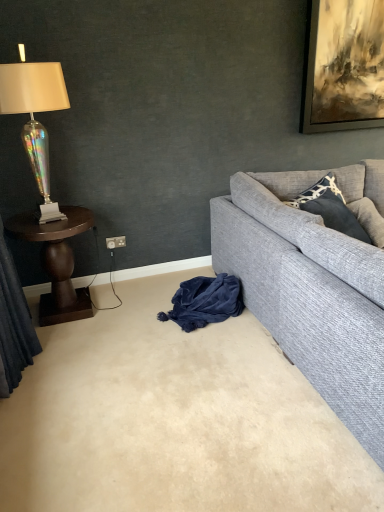
At what (x,y) coordinates should I click in order to perform the action: click on dark wood side table at left. Please return your answer as a coordinate pair (x, y). This screenshot has height=512, width=384. Looking at the image, I should click on (57, 262).

I want to click on iridescent fabric curtain at left, so click(x=14, y=325).

This screenshot has width=384, height=512. I want to click on white plastic power outlet at lower center, so click(115, 242).

Describe the element at coordinates (33, 117) in the screenshot. I see `iridescent glass lamp at left` at that location.

The width and height of the screenshot is (384, 512). Identify the location of velvet blue blanket at lower center. (205, 301).

Is dark gray textured pillow at upper right positioned before iridescent glass lamp at left?

No, dark gray textured pillow at upper right is further to the viewer.

Is dark gray textured pillow at upper right to the left of iridescent glass lamp at left from the viewer's perspective?

No, dark gray textured pillow at upper right is not to the left of iridescent glass lamp at left.

From the image's perspective, is dark gray textured pillow at upper right under iridescent glass lamp at left?

Indeed, from the image's perspective, dark gray textured pillow at upper right is shown beneath iridescent glass lamp at left.

Considering the sizes of objects dark gray textured pillow at upper right and iridescent glass lamp at left in the image provided, who is shorter, dark gray textured pillow at upper right or iridescent glass lamp at left?

dark gray textured pillow at upper right.

From the picture: Can you confirm if velvet blue blanket at lower center is taller than iridescent glass lamp at left?

No.

From a real-world perspective, which object rests below the other?

velvet blue blanket at lower center, from a real-world perspective.

Is point (186, 312) closer or farther from the camera than point (36, 89)?

Clearly, point (186, 312) is more distant from the camera than point (36, 89).

From the image's perspective, is velvet blue blanket at lower center located above or below iridescent glass lamp at left?

Based on their image positions, velvet blue blanket at lower center is located beneath iridescent glass lamp at left.

Is iridescent glass lamp at left next to dark wood side table at left?

No, iridescent glass lamp at left is not in contact with dark wood side table at left.

From the image's perspective, which object appears higher, iridescent glass lamp at left or dark wood side table at left?

iridescent glass lamp at left is shown above in the image.

Based on the photo, from a real-world perspective, does iridescent glass lamp at left stand above dark wood side table at left?

Correct, in the physical world, iridescent glass lamp at left is higher than dark wood side table at left.

Is iridescent glass lamp at left situated inside dark wood side table at left or outside?

The correct answer is: outside.

From the image's perspective, which one is positioned lower, iridescent glass lamp at left or dark gray textured pillow at upper right?

dark gray textured pillow at upper right appears lower in the image.

Considering the sizes of iridescent glass lamp at left and dark gray textured pillow at upper right in the image, is iridescent glass lamp at left wider or thinner than dark gray textured pillow at upper right?

iridescent glass lamp at left is wider than dark gray textured pillow at upper right.

Does point (59, 83) appear closer or farther from the camera than point (326, 215)?

Point (59, 83) is closer to the camera than point (326, 215).

Which is behind, gray fabric couch at right or velvet blue blanket at lower center?

velvet blue blanket at lower center.

From a real-world perspective, is gray fabric couch at right on velvet blue blanket at lower center?

Yes.

Between gray fabric couch at right and velvet blue blanket at lower center, which one has larger width?

gray fabric couch at right.

From the image's perspective, would you say gray fabric couch at right is shown under beige carpet at lower center?

No, from the image's perspective, gray fabric couch at right is not beneath beige carpet at lower center.

From a real-world perspective, is gray fabric couch at right physically above beige carpet at lower center?

Yes, from a real-world perspective, gray fabric couch at right is on top of beige carpet at lower center.

Does gray fabric couch at right lie in front of beige carpet at lower center?

That is True.

Is gray fabric couch at right next to beige carpet at lower center and touching it?

They are not placed beside each other.

How different are the orientations of beige carpet at lower center and white plastic power outlet at lower center in degrees?

The angular difference between beige carpet at lower center and white plastic power outlet at lower center is 178 degrees.

Is beige carpet at lower center oriented towards white plastic power outlet at lower center?

No, beige carpet at lower center is not facing towards white plastic power outlet at lower center.

From their relative heights in the image, would you say beige carpet at lower center is taller or shorter than white plastic power outlet at lower center?

In the image, beige carpet at lower center appears to be shorter than white plastic power outlet at lower center.

Can you confirm if beige carpet at lower center is bigger than white plastic power outlet at lower center?

Yes, beige carpet at lower center is bigger than white plastic power outlet at lower center.

At what (x,y) coordinates should I click in order to perform the action: click on lamp in front of the dark gray textured pillow at upper right. Please return your answer as a coordinate pair (x, y). This screenshot has height=512, width=384. Looking at the image, I should click on 33,117.

Where is `material behind the iridescent glass lamp at left`? Image resolution: width=384 pixels, height=512 pixels. material behind the iridescent glass lamp at left is located at coordinates (205, 301).

Looking at the image, which one is located closer to dark gray textured pillow at upper right, iridescent glass lamp at left or gray fabric couch at right?

gray fabric couch at right lies closer to dark gray textured pillow at upper right than the other object.

Considering their positions, is dark gray textured pillow at upper right positioned further to gray fabric couch at right than dark wood side table at left?

dark wood side table at left lies further to gray fabric couch at right than the other object.

Estimate the real-world distances between objects in this image. Which object is closer to iridescent glass lamp at left, iridescent fabric curtain at left or dark gray textured pillow at upper right?

iridescent fabric curtain at left is positioned closer to the anchor iridescent glass lamp at left.

From the image, which object appears to be farther from beige carpet at lower center, gray fabric couch at right or velvet blue blanket at lower center?

Among the two, gray fabric couch at right is located further to beige carpet at lower center.

Which object lies further to the anchor point dark wood side table at left, beige carpet at lower center or gray fabric couch at right?

gray fabric couch at right is positioned further to the anchor dark wood side table at left.

Looking at the image, which one is located closer to velvet blue blanket at lower center, iridescent glass lamp at left or gray fabric couch at right?

gray fabric couch at right is positioned closer to the anchor velvet blue blanket at lower center.

Looking at the image, which one is located further to white plastic power outlet at lower center, dark wood side table at left or velvet blue blanket at lower center?

The object further to white plastic power outlet at lower center is velvet blue blanket at lower center.

From the image, which object appears to be nearer to beige carpet at lower center, iridescent glass lamp at left or gray fabric couch at right?

Among the two, gray fabric couch at right is located nearer to beige carpet at lower center.

This screenshot has height=512, width=384. Identify the location of plain between iridescent fabric curtain at left and velvet blue blanket at lower center. pyautogui.click(x=174, y=419).

The image size is (384, 512). Identify the location of plain between iridescent glass lamp at left and dark gray textured pillow at upper right from left to right. (174, 419).

This screenshot has width=384, height=512. What are the coordinates of `lamp situated between iridescent fabric curtain at left and dark gray textured pillow at upper right from left to right` in the screenshot? It's located at (33, 117).

This screenshot has height=512, width=384. I want to click on lamp positioned between iridescent fabric curtain at left and white plastic power outlet at lower center from near to far, so click(x=33, y=117).